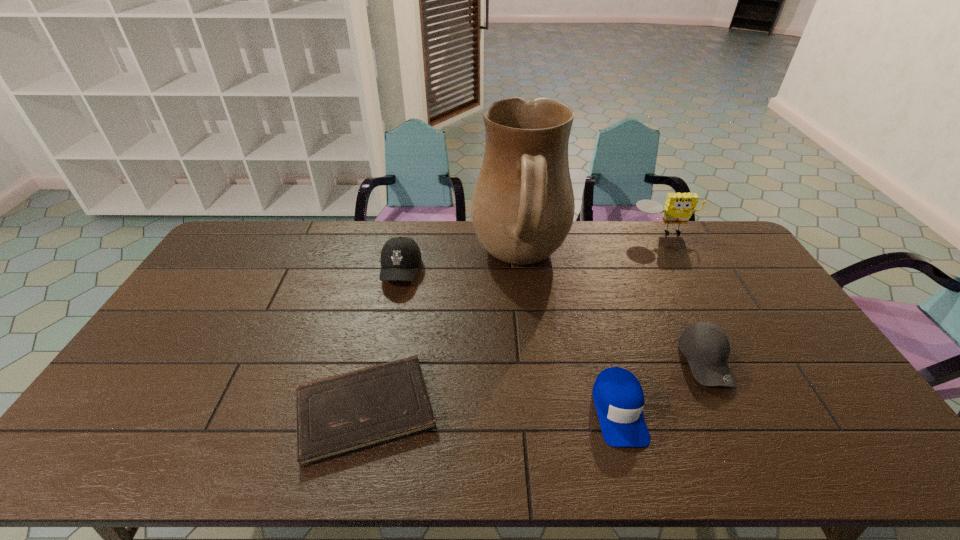
Where is `free space located on the front-facing side of the farthest baseball cap`? free space located on the front-facing side of the farthest baseball cap is located at coordinates (375, 395).

Where is `free spot located on the front brim of the rightmost baseball cap`? Image resolution: width=960 pixels, height=540 pixels. free spot located on the front brim of the rightmost baseball cap is located at coordinates (734, 419).

Identify the location of vacant region located on the right of the shortest object. (482, 409).

Locate an element on the screen. This screenshot has height=540, width=960. cream pitcher that is positioned at the far edge is located at coordinates (522, 209).

Where is `sponge located at the far edge`? sponge located at the far edge is located at coordinates (679, 207).

Locate an element on the screen. The width and height of the screenshot is (960, 540). baseball cap present at the far edge is located at coordinates (400, 257).

Locate an element on the screen. The height and width of the screenshot is (540, 960). baseball cap that is at the near edge is located at coordinates (618, 396).

Locate an element on the screen. This screenshot has width=960, height=540. paperback book situated at the near edge is located at coordinates (338, 415).

Image resolution: width=960 pixels, height=540 pixels. Identify the location of object that is at the right edge. (679, 207).

Where is `object that is at the far right corner`? This screenshot has height=540, width=960. object that is at the far right corner is located at coordinates (679, 207).